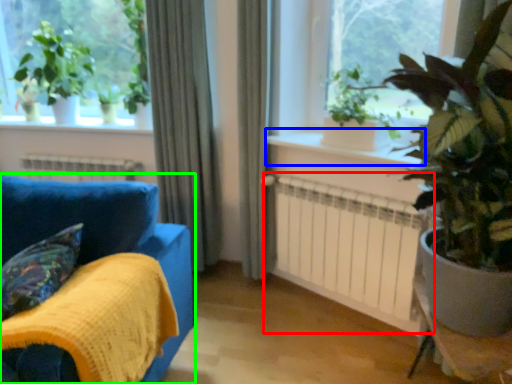
Question: Considering the real-world distances, which object is farthest from radiator (highlighted by a red box)? window sill (highlighted by a blue box) or furniture (highlighted by a green box)?

Choices:
 (A) window sill
 (B) furniture

Answer: (B)